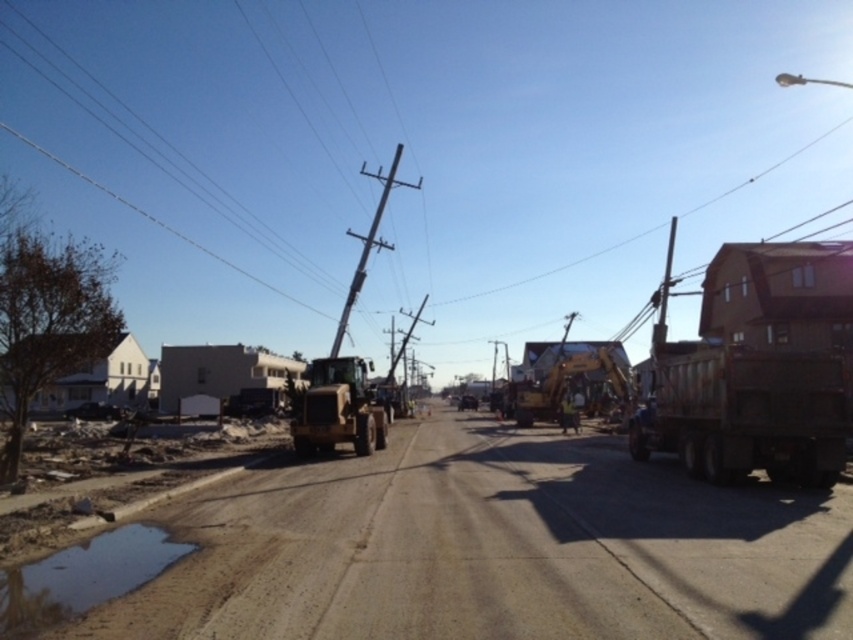
You are a delivery driver needing to pass through the dirt track at center while driving the rusty metal truck at right. Can you safely navigate through the track without going off the road?

The dirt track at center is wider than the rusty metal truck at right, so yes, you can safely navigate through the track without going off the road.

Consider the image. You are a delivery person trying to navigate through this construction site. You need to pass by the rusty metal truck at right and the smooth wood telegraph pole at center. Can you drive your van directly between them?

The rusty metal truck at right is positioned under the smooth wood telegraph pole at center, meaning the pole is directly above the truck. This would leave no space for the van to drive between them as they are vertically aligned.